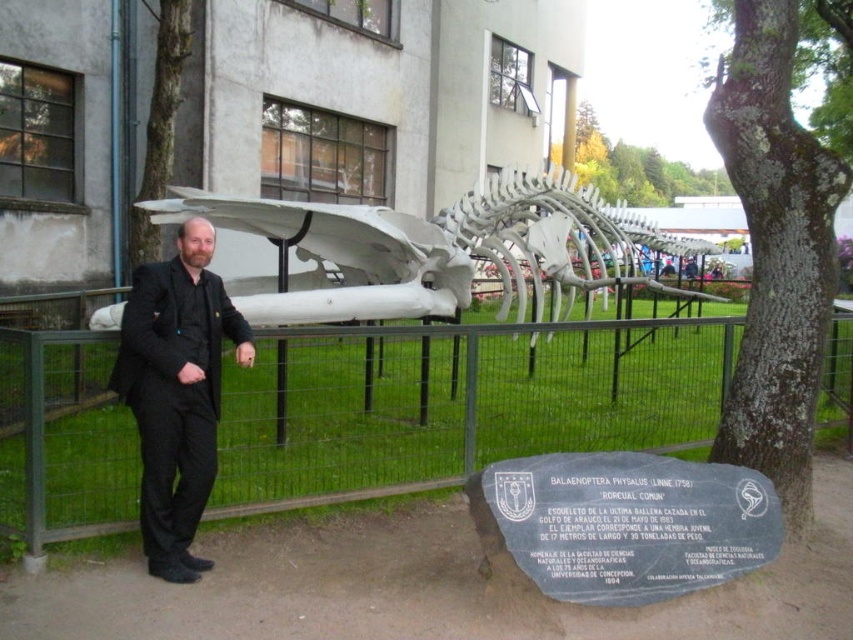
Does metal wire fence at center have a smaller size compared to white metallic whale skeleton at center?

Yes, metal wire fence at center is smaller than white metallic whale skeleton at center.

Does metal wire fence at center have a greater width compared to white metallic whale skeleton at center?

Incorrect, metal wire fence at center's width does not surpass white metallic whale skeleton at center's.

Does point (695, 401) come farther from viewer compared to point (625, 209)?

No.

At what (x,y) coordinates should I click in order to perform the action: click on metal wire fence at center. Please return your answer as a coordinate pair (x, y). The height and width of the screenshot is (640, 853). Looking at the image, I should click on (457, 403).

Is the position of metal wire fence at center less distant than that of black fabric suit at left?

That is False.

Can you confirm if metal wire fence at center is shorter than black fabric suit at left?

Indeed, metal wire fence at center has a lesser height compared to black fabric suit at left.

The height and width of the screenshot is (640, 853). Describe the element at coordinates (457, 403) in the screenshot. I see `metal wire fence at center` at that location.

Locate an element on the screen. metal wire fence at center is located at coordinates (457, 403).

Can you confirm if white metallic whale skeleton at center is bigger than black fabric suit at left?

Incorrect, white metallic whale skeleton at center is not larger than black fabric suit at left.

Is white metallic whale skeleton at center further to the viewer compared to black fabric suit at left?

Yes, it is.

Does point (364, 285) lie behind point (207, 449)?

Yes, it is behind point (207, 449).

Find the location of `white metallic whale skeleton at center`. white metallic whale skeleton at center is located at coordinates (437, 250).